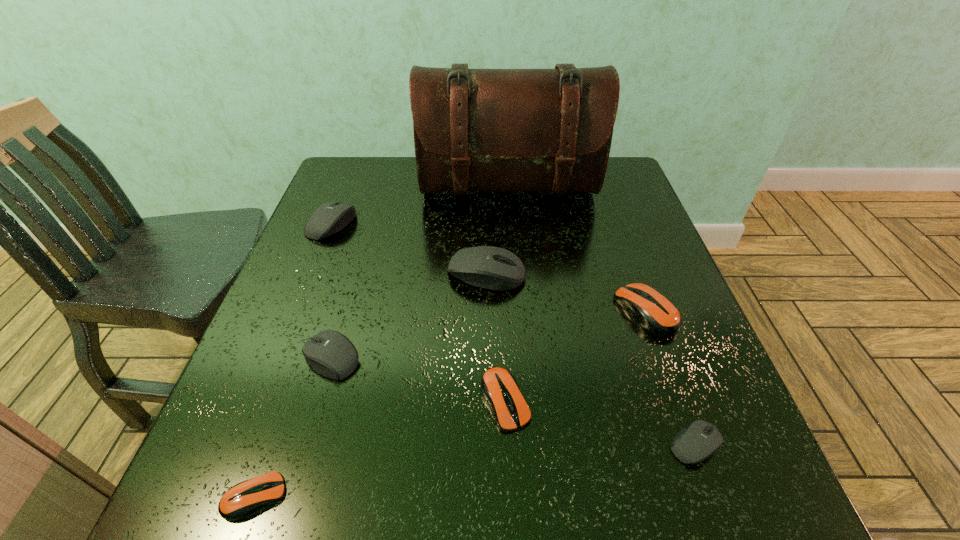
The image size is (960, 540). Identify the location of the second closest orange computer mouse to the second smallest orange computer mouse. (244, 498).

You are a GUI agent. You are given a task and a screenshot of the screen. Output one action in this format:
    pyautogui.click(x=<x>, y=<y>)
    Task: Click on the closest orange computer mouse to the tallest computer mouse
    The image size is (960, 540).
    Given the screenshot: What is the action you would take?
    pyautogui.click(x=655, y=313)